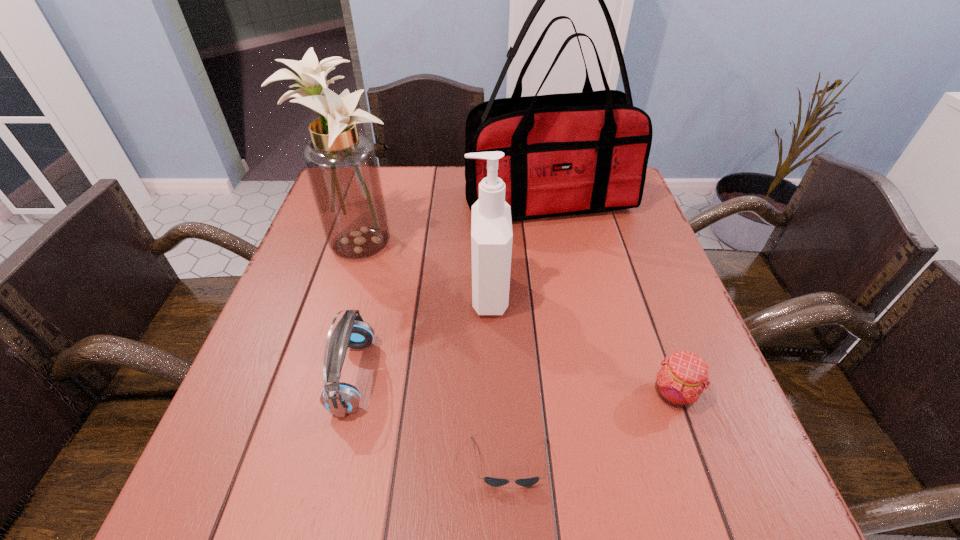
At what (x,y) coordinates should I click in order to perform the action: click on free space located on the front label of the cleansing agent. Please return your answer as a coordinate pair (x, y). Looking at the image, I should click on (433, 294).

At what (x,y) coordinates should I click in order to perform the action: click on vacant space located on the front label of the cleansing agent. Please return your answer as a coordinate pair (x, y). The image size is (960, 540). Looking at the image, I should click on (396, 294).

This screenshot has height=540, width=960. I want to click on vacant position located on the ear cups of the third shortest object, so click(x=423, y=376).

At what (x,y) coordinates should I click in order to perform the action: click on free space located on the left of the jam. Please return your answer as a coordinate pair (x, y). Looking at the image, I should click on (531, 394).

Find the location of a particular element. The height and width of the screenshot is (540, 960). object situated at the far edge is located at coordinates (565, 154).

This screenshot has width=960, height=540. Identify the location of object that is at the near edge. (495, 482).

I want to click on object that is positioned at the left edge, so click(x=341, y=164).

Locate an element on the screen. duffel bag positioned at the right edge is located at coordinates (565, 154).

This screenshot has width=960, height=540. Identify the location of jam located at the right edge. (683, 376).

Where is `object situated at the far right corner`? The height and width of the screenshot is (540, 960). object situated at the far right corner is located at coordinates [565, 154].